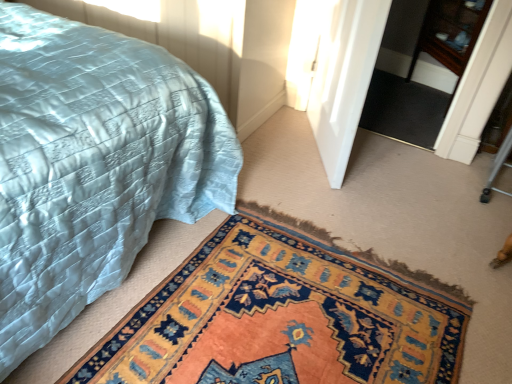
This screenshot has width=512, height=384. Identify the location of spots to the right of white glossy door at center. (401, 172).